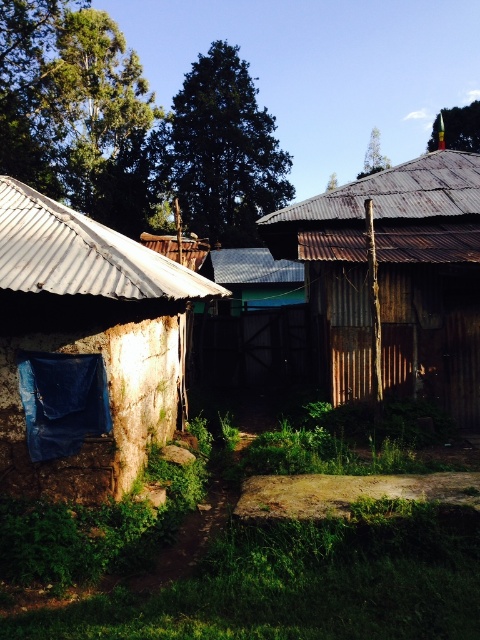
You are standing on the pathway in the foreground and want to go to the white stucco hut at left and the rusty corrugated hut at center. Which one is closer to your current position?

The white stucco hut at left is closer to your current position because it is to the left of the rusty corrugated hut at center, meaning it is positioned nearer along the pathway leading towards the buildings.

Based on the scene description, what are the coordinates of the rusty corrugated metal hut at center?

The rusty corrugated metal hut at center is located at coordinates point (88, 339).